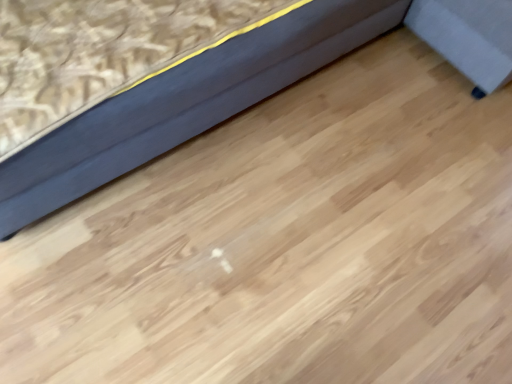
Question: Should I look upward or downward to see matte gray sofa at upper left?

Choices:
 (A) down
 (B) up

Answer: (B)